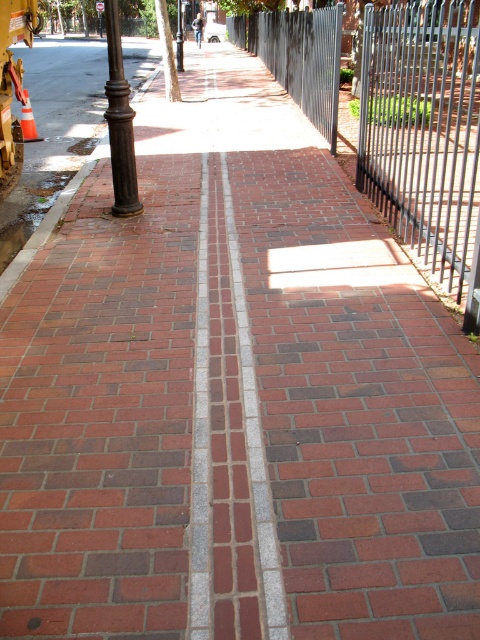
Is point (253, 42) positioned after point (178, 20)?

No, (253, 42) is in front of (178, 20).

Does point (369, 35) come farther from viewer compared to point (180, 35)?

No, (369, 35) is closer to viewer.

The image size is (480, 640). Find the location of `black metal fence at upper right`. black metal fence at upper right is located at coordinates (424, 134).

Who is higher up, black metal fence at upper right or bronze/weathered pole at left?

black metal fence at upper right is higher up.

How far apart are black metal fence at upper right and bronze/weathered pole at left?

They are 26.21 feet apart.

Where is `black metal fence at upper right`? Image resolution: width=480 pixels, height=640 pixels. black metal fence at upper right is located at coordinates (424, 134).

Is black metal fence at upper right bigger than black metal fence at right?

Indeed, black metal fence at upper right has a larger size compared to black metal fence at right.

Is black metal fence at upper right shorter than black metal fence at right?

No.

Which is behind, point (393, 24) or point (462, 220)?

Positioned behind is point (462, 220).

Locate an element on the screen. This screenshot has width=480, height=640. black metal fence at upper right is located at coordinates (424, 134).